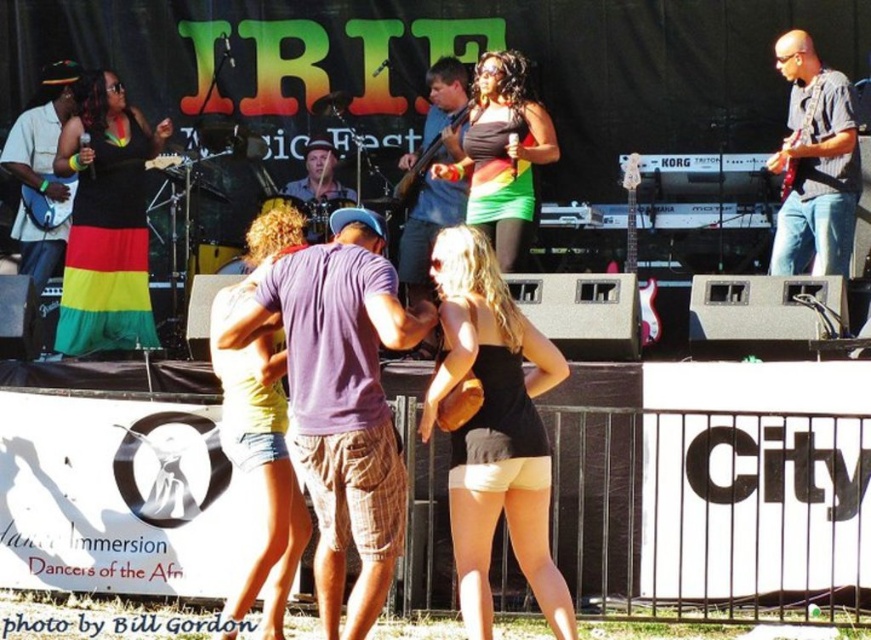
Question: In this image, where is matte blue shirt at center located relative to matte black bass guitar at center?

Choices:
 (A) left
 (B) right

Answer: (B)

Question: Among these points, which one is nearest to the camera?

Choices:
 (A) (511, 406)
 (B) (427, 307)
 (C) (133, 272)
 (D) (287, 189)

Answer: (A)

Question: Is rainbow fabric skirt at center below matte black shirt at left?

Choices:
 (A) yes
 (B) no

Answer: (B)

Question: Which of the following is the closest to the observer?

Choices:
 (A) (804, 202)
 (B) (325, 164)
 (C) (457, 432)

Answer: (C)

Question: Can you confirm if matte black shirt at left is thinner than matte black bass guitar at center?

Choices:
 (A) no
 (B) yes

Answer: (A)

Question: Which object is the closest to the matte yellow shorts at center?

Choices:
 (A) black matte tank top at center
 (B) rasta-patterned dress at left
 (C) matte black bass guitar at center
 (D) matte brown drum set at center

Answer: (A)